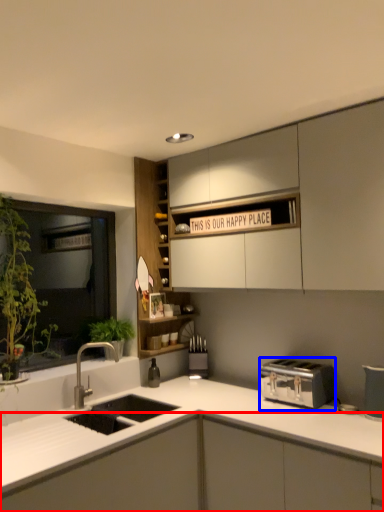
Question: Which point is further to the camera, cabinetry (highlighted by a red box) or toaster (highlighted by a blue box)?

Choices:
 (A) cabinetry
 (B) toaster

Answer: (B)